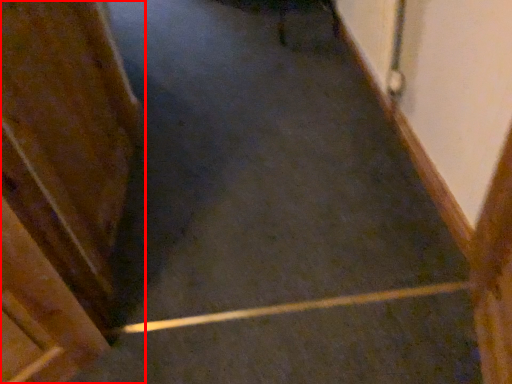
Question: From the image's perspective, where is door (annotated by the red box) located relative to stairs?

Choices:
 (A) below
 (B) above

Answer: (B)